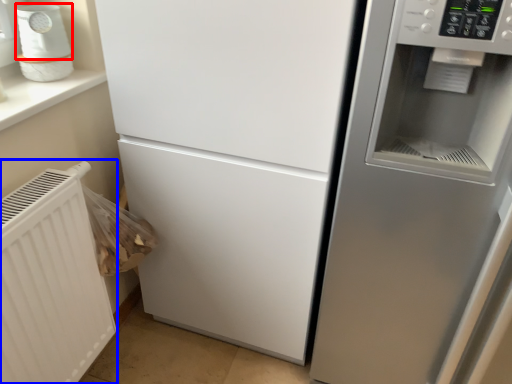
Question: Which of the following is the closest to the observer, appliance (highlighted by a red box) or radiator (highlighted by a blue box)?

Choices:
 (A) appliance
 (B) radiator

Answer: (B)